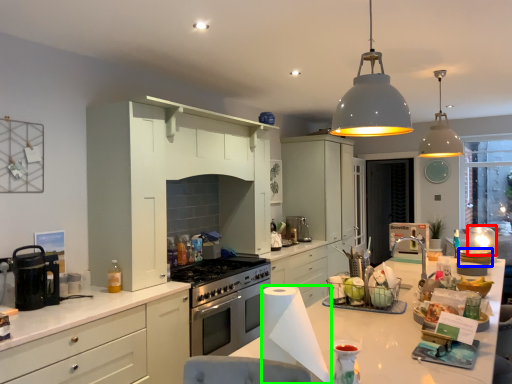
Question: Based on their relative distances, which object is nearer to appliance (highlighted by a red box)? Choose from appliance (highlighted by a blue box) and paper towel (highlighted by a green box).

Choices:
 (A) appliance
 (B) paper towel

Answer: (A)